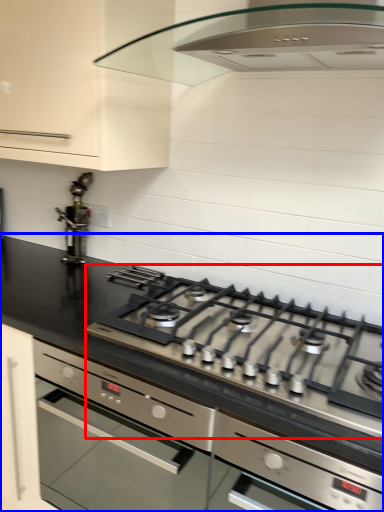
Question: Which object is further to the camera taking this photo, gas stove (highlighted by a red box) or countertop (highlighted by a blue box)?

Choices:
 (A) gas stove
 (B) countertop

Answer: (B)